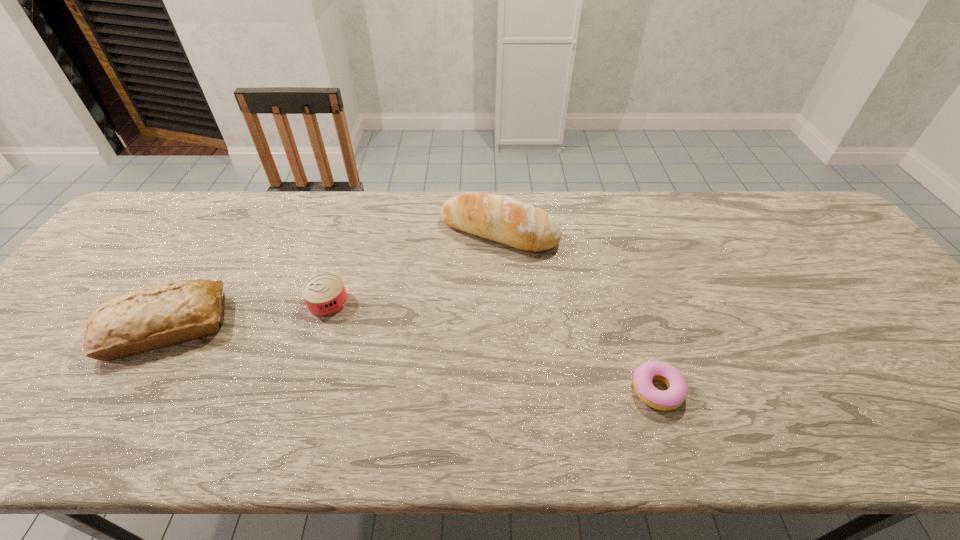
This screenshot has height=540, width=960. In order to click on free space in the image that satisfies the following two spatial constraints: 1. on the back side of the leftmost object; 2. on the right side of the third object from left to right in this screenshot , I will do `click(226, 231)`.

I want to click on free space that satisfies the following two spatial constraints: 1. on the back side of the farthest object; 2. on the right side of the third tallest object, so click(x=350, y=231).

The height and width of the screenshot is (540, 960). In order to click on free space that satisfies the following two spatial constraints: 1. on the back side of the nearer bread; 2. on the right side of the third tallest object in this screenshot , I will do `click(181, 302)`.